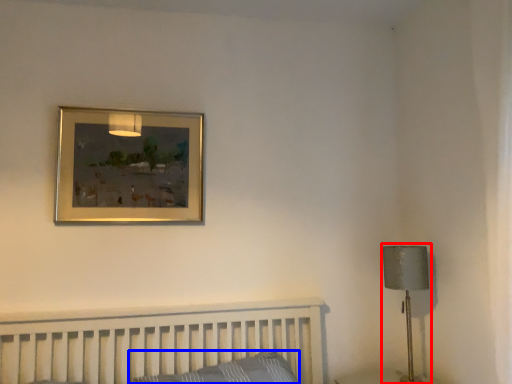
Question: Which of the following is the farthest to the observer, table lamp (highlighted by a red box) or pillow (highlighted by a blue box)?

Choices:
 (A) table lamp
 (B) pillow

Answer: (A)